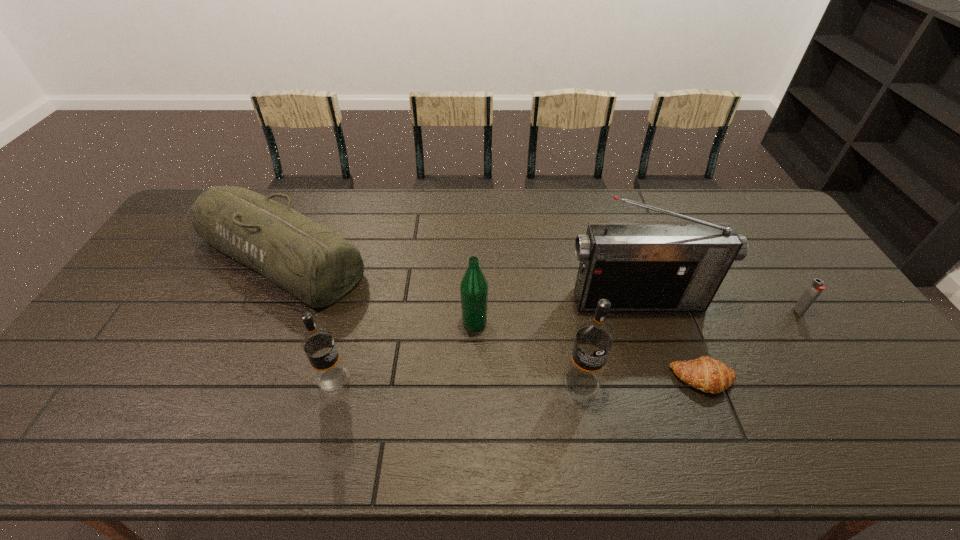
Identify the location of free spot that satisfies the following two spatial constraints: 1. on the back side of the shortest object; 2. on the label of the left vodka. (703, 379).

You are a GUI agent. You are given a task and a screenshot of the screen. Output one action in this format:
    pyautogui.click(x=<x>, y=<y>)
    Task: Click on the free space that satisfies the following two spatial constraints: 1. on the front-facing side of the radio receiver; 2. on the label of the shorter vodka
    This screenshot has height=540, width=960.
    Given the screenshot: What is the action you would take?
    pyautogui.click(x=663, y=379)

In order to click on vacant region that satisfies the following two spatial constraints: 1. on the front-facing side of the radio receiver; 2. on the label of the left vodka in this screenshot , I will do `click(663, 379)`.